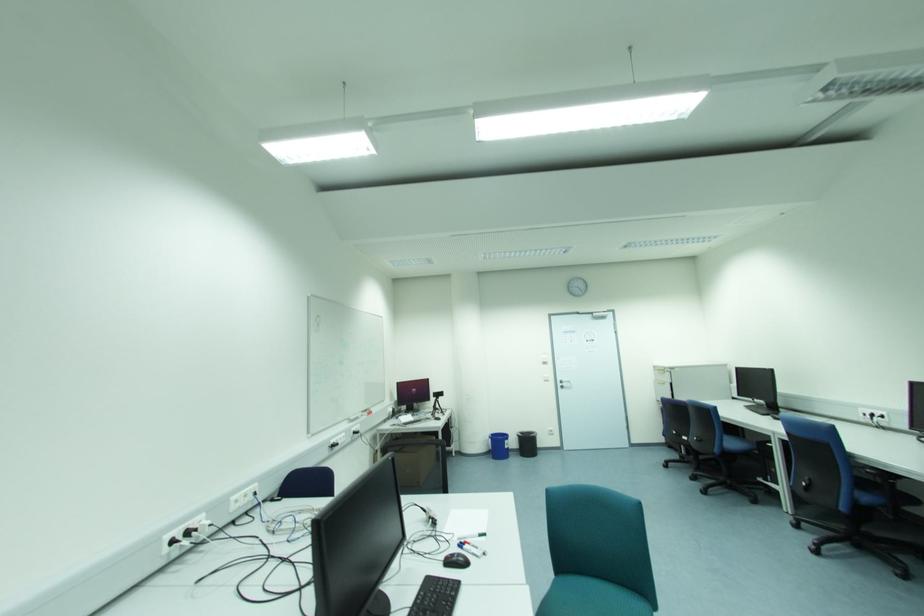
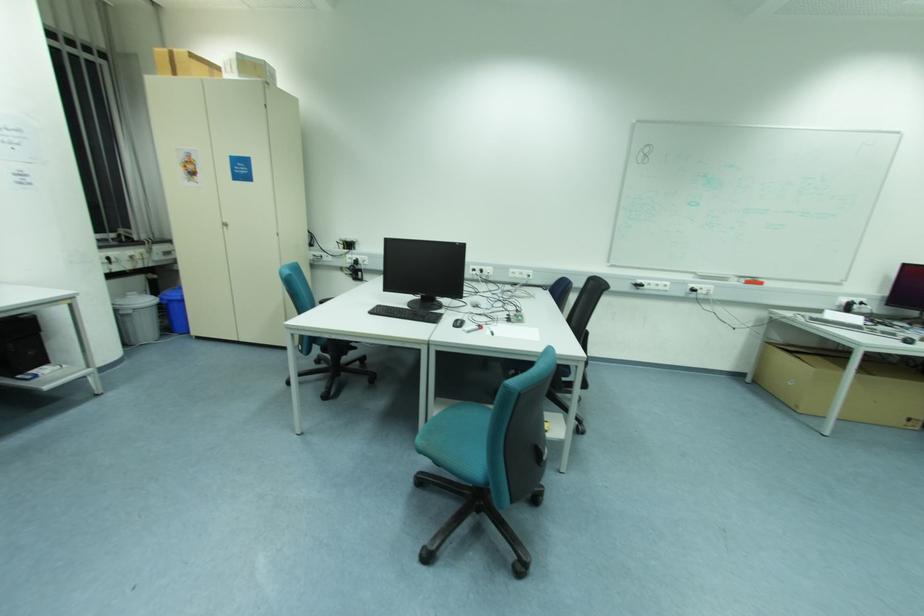
The point at (x=371, y=413) is marked in the first image. Where is the corresponding point in the second image?

(761, 284)